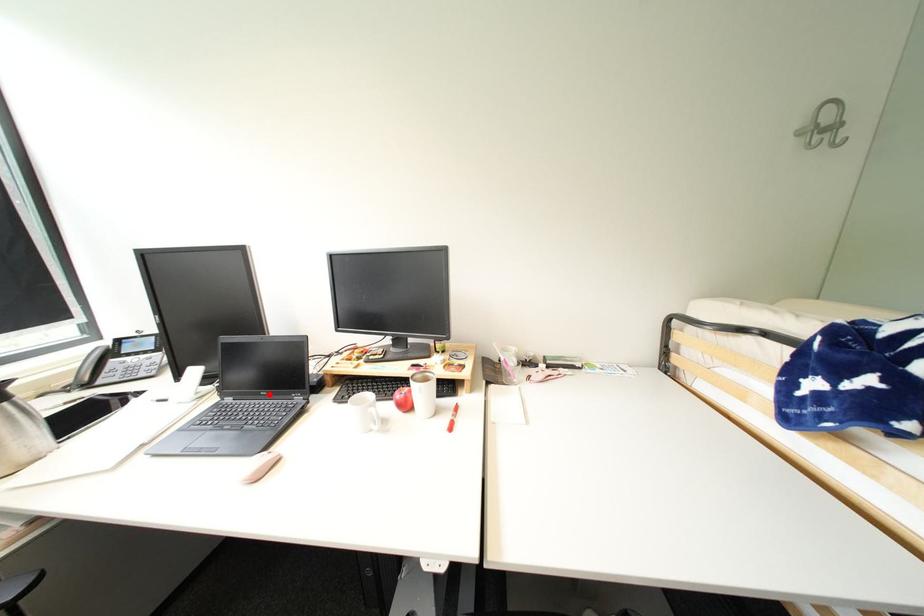
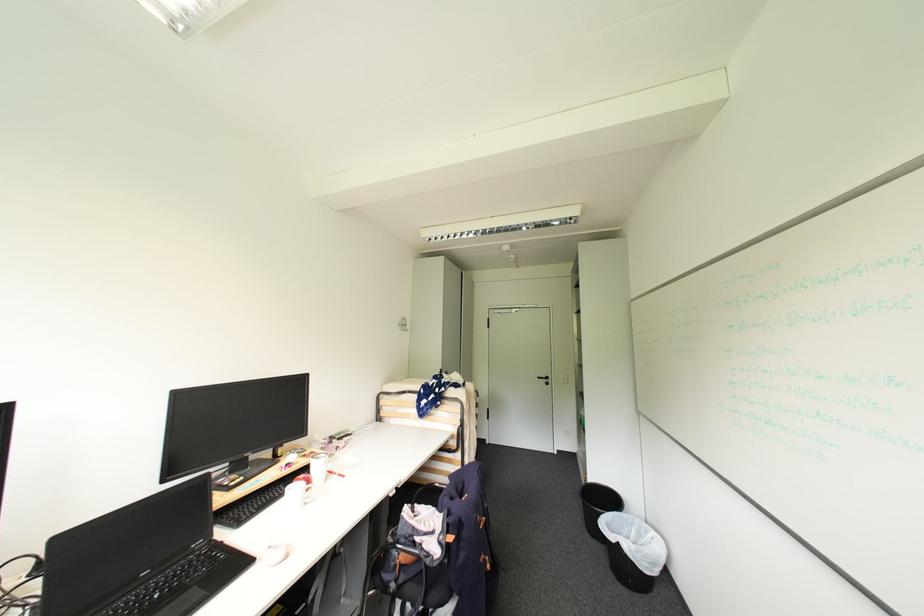
The point at the highlighted location is marked in the first image. Where is the corresponding point in the second image?

(150, 575)